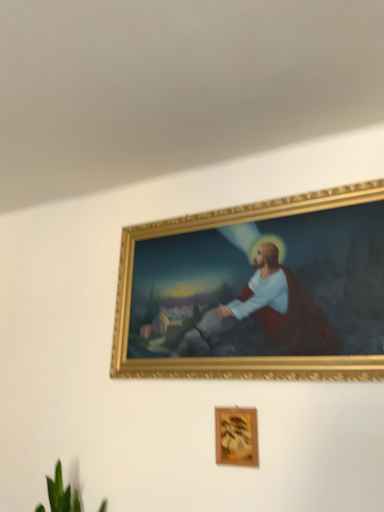
Question: Is point (51, 496) closer or farther from the camera than point (236, 418)?

Choices:
 (A) closer
 (B) farther

Answer: (B)

Question: Choose the correct answer: Is green leafy plant at lower left inside wooden frame at lower center, arranged as the first picture frame when ordered from the bottom, or outside it?

Choices:
 (A) inside
 (B) outside

Answer: (B)

Question: Based on their relative distances, which object is farther from the gold/gilded picture frame at upper center, acting as the 2th picture frame starting from the bottom?

Choices:
 (A) green leafy plant at lower left
 (B) wooden frame at lower center, placed as the second picture frame when sorted from right to left

Answer: (A)

Question: Based on their relative distances, which object is farther from the green leafy plant at lower left?

Choices:
 (A) wooden frame at lower center, placed as the second picture frame when sorted from right to left
 (B) gold/gilded picture frame at upper center, positioned as the second picture frame in left-to-right order

Answer: (B)